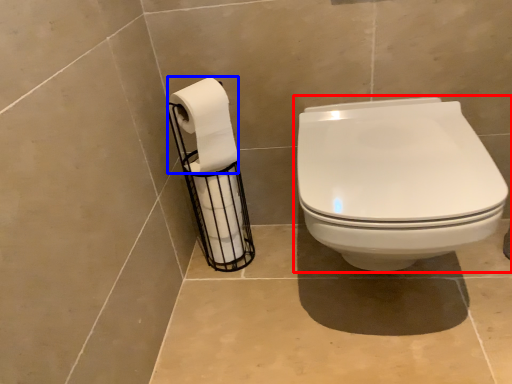
Question: Which object appears closest to the camera in this image, toilet (highlighted by a red box) or toilet paper (highlighted by a blue box)?

Choices:
 (A) toilet
 (B) toilet paper

Answer: (A)